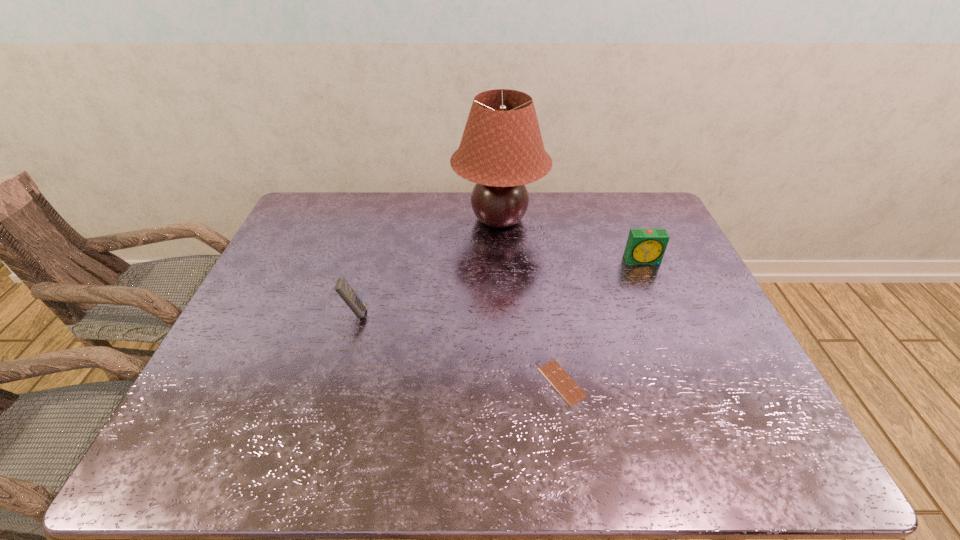
The width and height of the screenshot is (960, 540). In order to click on free spot between the third nearest object and the leftmost object in this screenshot , I will do `click(498, 287)`.

Locate which object ranks second in proximity to the chocolate bar. Please provide its 2D coordinates. Your answer should be formatted as a tuple, i.e. [(x, y)], where the tuple contains the x and y coordinates of a point satisfying the conditions above.

[(501, 150)]

Select which object is the third closest to the nearest object. Please provide its 2D coordinates. Your answer should be formatted as a tuple, i.e. [(x, y)], where the tuple contains the x and y coordinates of a point satisfying the conditions above.

[(343, 288)]

This screenshot has height=540, width=960. Find the location of `vacant space that satisfies the following two spatial constraints: 1. on the front-facing side of the farthest object; 2. on the right side of the shortest object`. vacant space that satisfies the following two spatial constraints: 1. on the front-facing side of the farthest object; 2. on the right side of the shortest object is located at coordinates (509, 382).

Identify the location of vacant space that satisfies the following two spatial constraints: 1. on the front-facing side of the rightmost object; 2. on the front-facing side of the calculator. This screenshot has height=540, width=960. (665, 313).

Identify the location of free point that satisfies the following two spatial constraints: 1. on the back side of the nearest object; 2. on the front-facing side of the farthest object. (536, 219).

I want to click on vacant point that satisfies the following two spatial constraints: 1. on the back side of the shortest object; 2. on the front-facing side of the farthest object, so click(x=536, y=219).

Find the location of a particular element. This screenshot has height=540, width=960. free spot that satisfies the following two spatial constraints: 1. on the front-facing side of the lampshade; 2. on the left side of the shortest object is located at coordinates (509, 382).

Identify the location of free point that satisfies the following two spatial constraints: 1. on the front-facing side of the third nearest object; 2. on the front-facing side of the leftmost object. The height and width of the screenshot is (540, 960). (665, 313).

What are the coordinates of `free spot that satisfies the following two spatial constraints: 1. on the back side of the chocolate bar; 2. on the front-facing side of the leftmost object` in the screenshot? It's located at (551, 313).